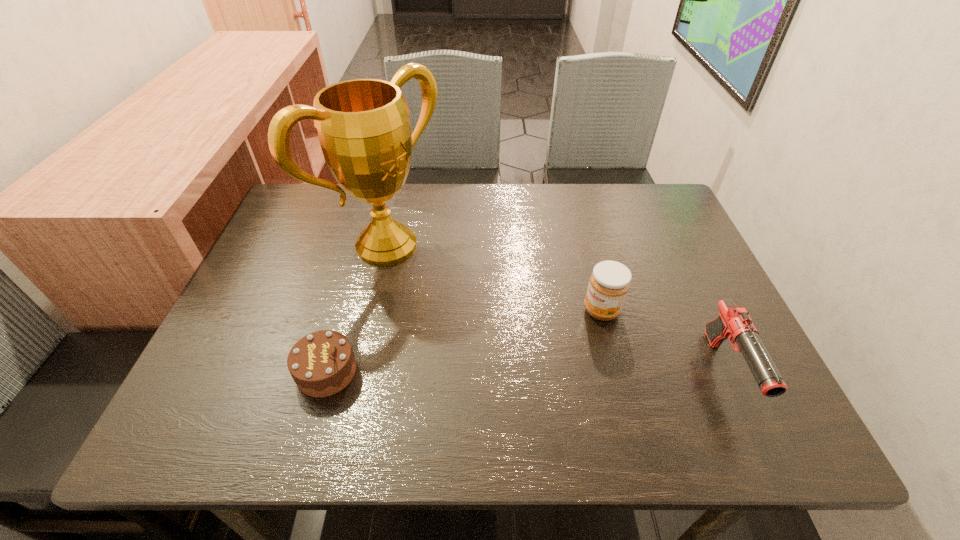
I want to click on free spot on the desktop that is between the chocolate cake and the rightmost object and is positioned on the front-facing side of the award, so click(x=570, y=372).

Where is `vacant space on the desktop that is between the shortest object and the rightmost object and is positioned on the front label of the jam`? vacant space on the desktop that is between the shortest object and the rightmost object and is positioned on the front label of the jam is located at coordinates (511, 372).